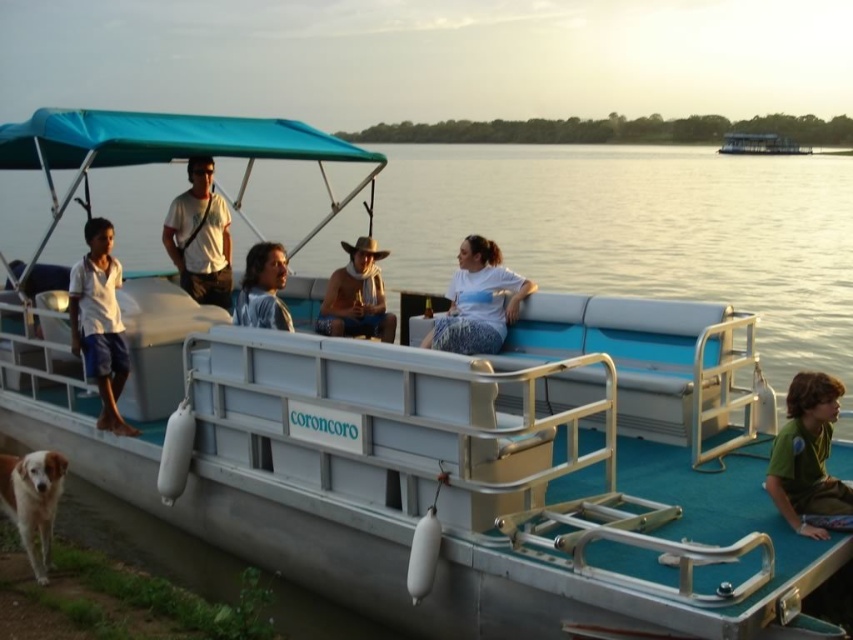
From the picture: Does white matte shirt at center have a greater height compared to matte black shirt at center?

Yes.

Can you confirm if white matte shirt at center is wider than matte black shirt at center?

Correct, the width of white matte shirt at center exceeds that of matte black shirt at center.

The image size is (853, 640). What are the coordinates of `white matte shirt at center` in the screenshot? It's located at (479, 301).

Image resolution: width=853 pixels, height=640 pixels. What are the coordinates of `white matte shirt at center` in the screenshot? It's located at (479, 301).

Is white matte shirt at left to the right of blue plastic boat at center from the viewer's perspective?

Incorrect, white matte shirt at left is not on the right side of blue plastic boat at center.

Is white matte shirt at left below blue plastic boat at center?

Correct, white matte shirt at left is located below blue plastic boat at center.

Is point (115, 284) farther from viewer compared to point (788, 152)?

No, it is not.

This screenshot has width=853, height=640. Find the location of `white matte shirt at left`. white matte shirt at left is located at coordinates (99, 321).

Between green fabric shirt at lower right and white matte shirt at left, which one is positioned higher?

white matte shirt at left is higher up.

Consider the image. Does green fabric shirt at lower right appear over white matte shirt at left?

→ No, green fabric shirt at lower right is not above white matte shirt at left.

Locate an element on the screen. This screenshot has width=853, height=640. green fabric shirt at lower right is located at coordinates [807, 456].